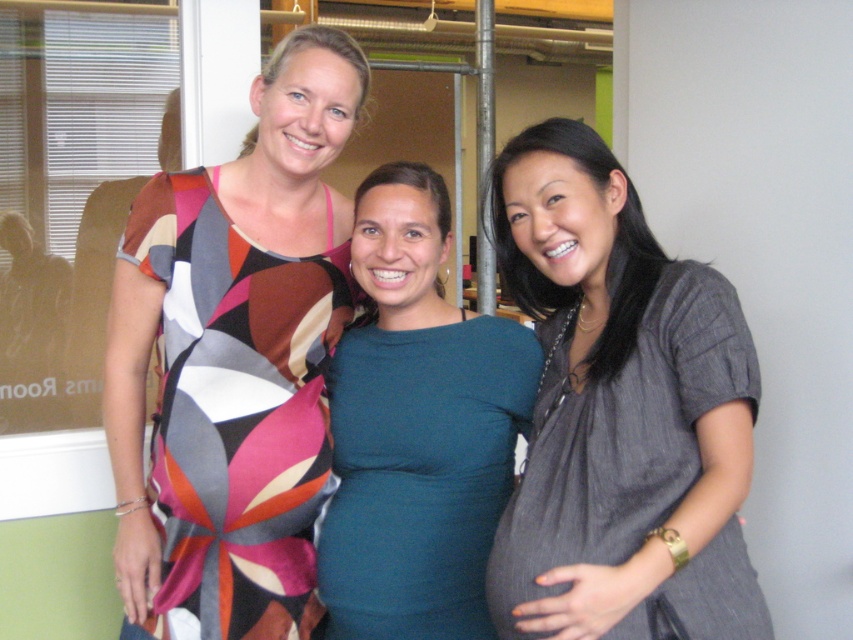
You are a photographer setting up for a group photo. You have two women in front of you wearing the multicolored fabric dress at left and the teal jersey dress at center. To ensure both are framed properly, you need to know which dress is larger. Can you tell me which one is bigger?

The multicolored fabric dress at left is bigger than the teal jersey dress at center, so the photographer should adjust the framing to accommodate the larger dress on the left.

In the scene shown: You are a photographer arranging three women for a photo shoot. The women are wearing the gray textured dress at center and the teal jersey dress at center. You need to ensure that the taller dress is placed in the middle to balance the composition. Which dress should be positioned at the center?

The gray textured dress at center is taller than the teal jersey dress at center, so the gray textured dress at center should be placed in the middle to balance the composition.